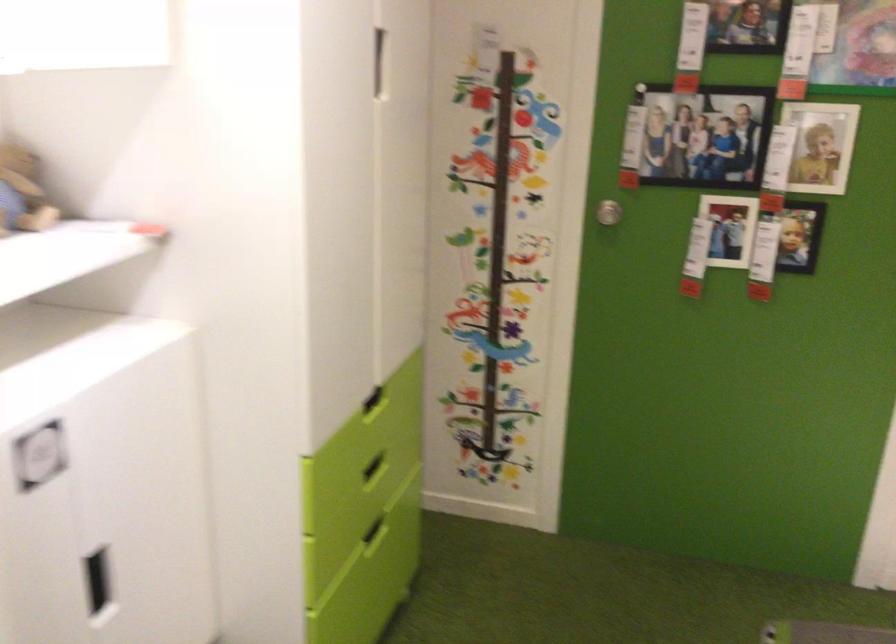
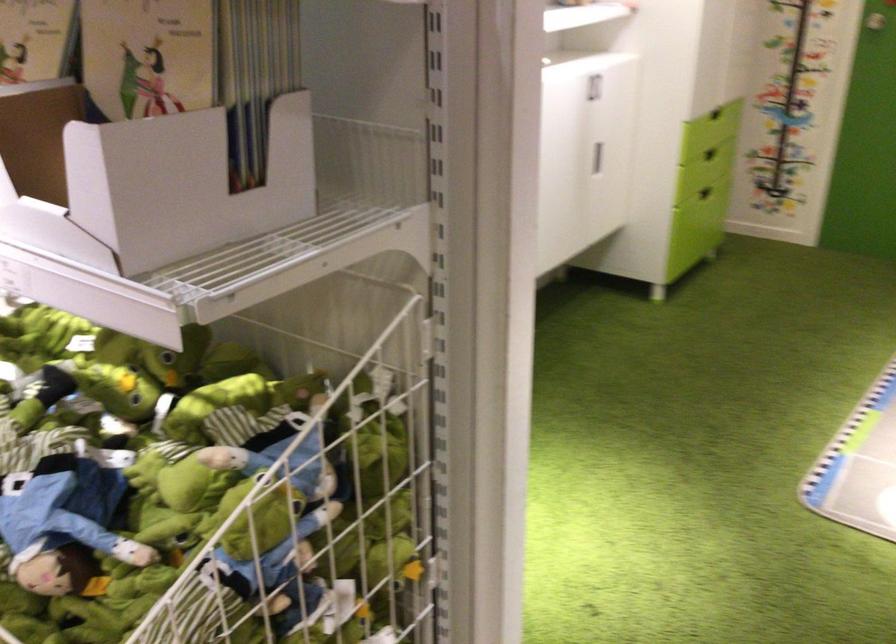
The point at (113, 574) is marked in the first image. Where is the corresponding point in the second image?

(597, 158)